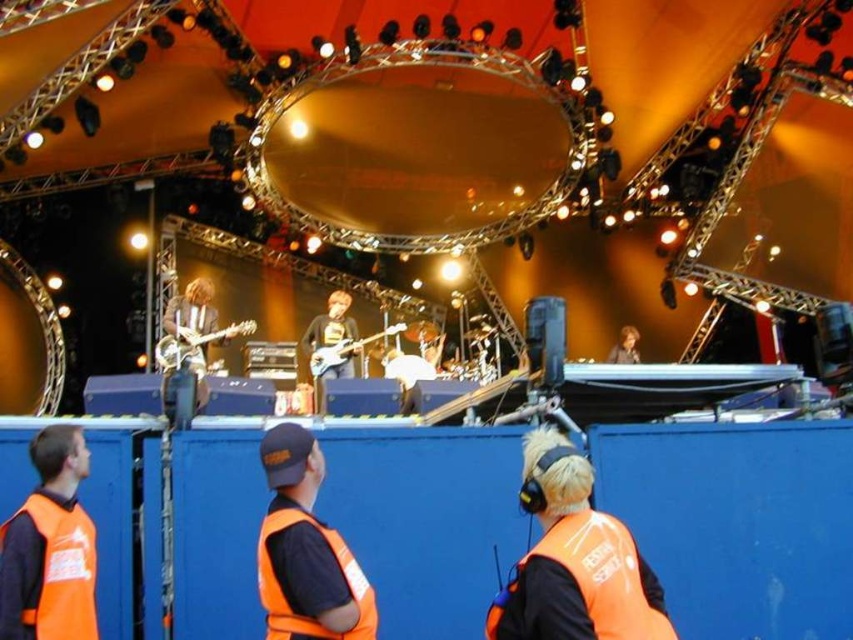
Is orange fabric safety vest at lower left taller than smooth black jacket at upper center?

Yes, orange fabric safety vest at lower left is taller than smooth black jacket at upper center.

Who is taller, orange fabric safety vest at lower left or smooth black jacket at upper center?

With more height is orange fabric safety vest at lower left.

Is point (51, 596) more distant than point (619, 358)?

No, it is in front of (619, 358).

Where is `orange fabric safety vest at lower left`? The height and width of the screenshot is (640, 853). orange fabric safety vest at lower left is located at coordinates (62, 570).

Measure the distance from orange reflective vest at lower right to smooth black jacket at upper center.

orange reflective vest at lower right and smooth black jacket at upper center are 29.49 meters apart from each other.

Is point (538, 570) farther from viewer compared to point (631, 349)?

No, (538, 570) is closer to viewer.

The image size is (853, 640). I want to click on orange reflective vest at lower right, so click(573, 561).

Which is more to the left, orange reflective vest at lower right or orange fabric safety vest at center?

orange fabric safety vest at center is more to the left.

Where is `orange reflective vest at lower right`? Image resolution: width=853 pixels, height=640 pixels. orange reflective vest at lower right is located at coordinates (573, 561).